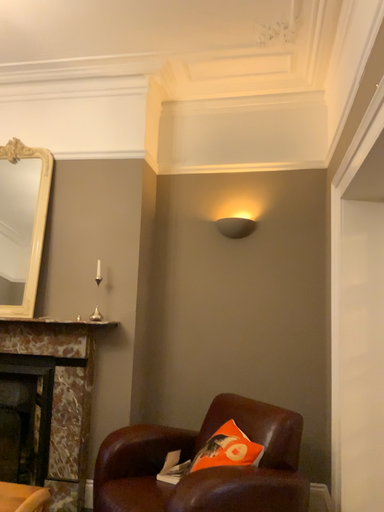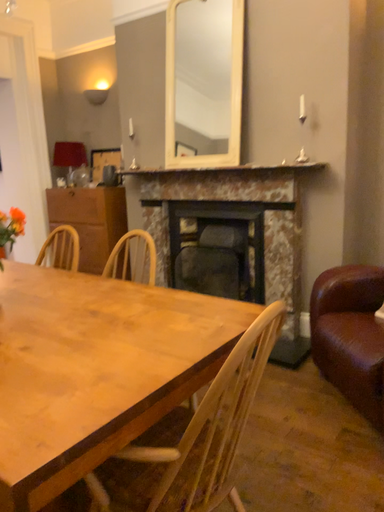
Question: Which way did the camera rotate in the video?

Choices:
 (A) rotated right
 (B) rotated left

Answer: (B)